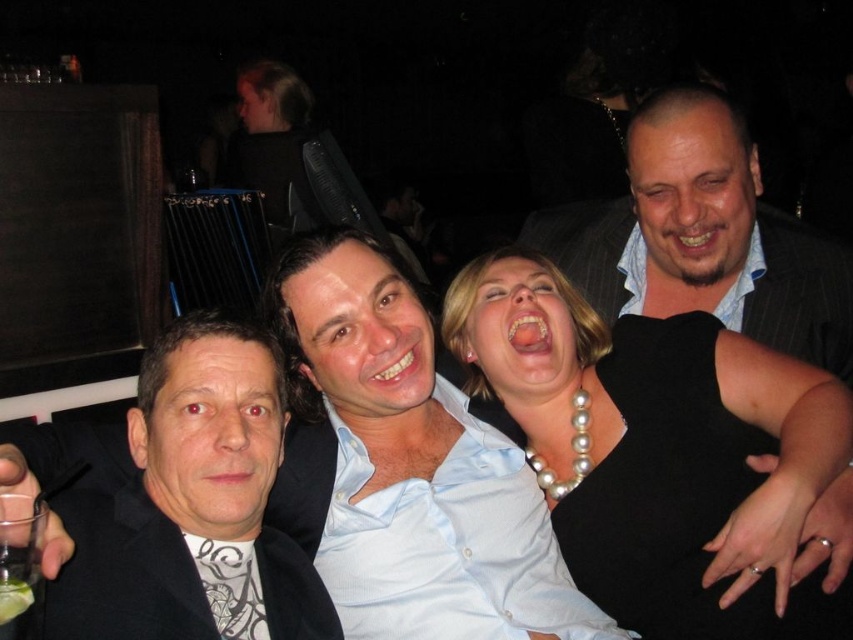
Question: Which of the following is the farthest from the observer?

Choices:
 (A) (808, 460)
 (B) (204, 534)
 (C) (547, 557)
 (D) (33, 554)

Answer: (C)

Question: Does pearl necklace at center come behind light blue shirt at center?

Choices:
 (A) yes
 (B) no

Answer: (B)

Question: In this image, where is pearl necklace at center located relative to green translucent glass at lower left?

Choices:
 (A) above
 (B) below

Answer: (A)

Question: Which of the following is the farthest from the observer?

Choices:
 (A) light blue shirt at center
 (B) black matte jacket at left
 (C) green translucent glass at lower left
 (D) pearl necklace at center

Answer: (A)

Question: Which object is the closest to the pearl necklace at center?

Choices:
 (A) black matte jacket at left
 (B) light blue shirt at center
 (C) green translucent glass at lower left

Answer: (B)

Question: Is light blue shirt at center positioned at the back of green translucent glass at lower left?

Choices:
 (A) yes
 (B) no

Answer: (A)